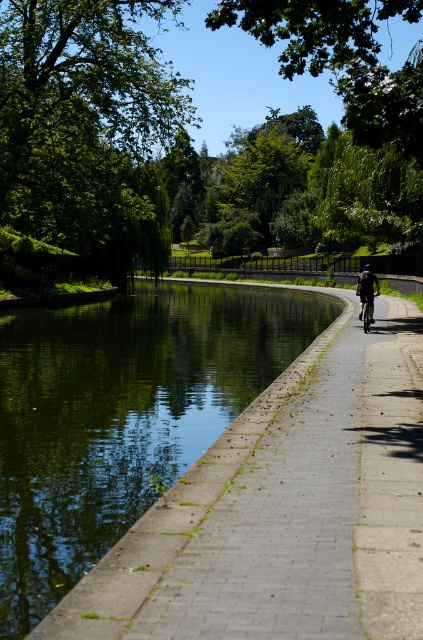
Can you confirm if green concrete river at center is wider than dark blue fabric jacket at center-right?

Yes.

Does green concrete river at center have a larger size compared to dark blue fabric jacket at center-right?

Correct, green concrete river at center is larger in size than dark blue fabric jacket at center-right.

Identify the location of green concrete river at center. The width and height of the screenshot is (423, 640). (120, 417).

Is green concrete river at center positioned in front of shiny silver bicycle at center?

Yes, green concrete river at center is in front of shiny silver bicycle at center.

Locate an element on the screen. green concrete river at center is located at coordinates (120, 417).

Locate an element on the screen. green concrete river at center is located at coordinates (120, 417).

I want to click on green concrete river at center, so click(120, 417).

Is dark blue fabric jacket at center-right to the left of shiny silver bicycle at center from the viewer's perspective?

Incorrect, dark blue fabric jacket at center-right is not on the left side of shiny silver bicycle at center.

Who is taller, dark blue fabric jacket at center-right or shiny silver bicycle at center?

With more height is dark blue fabric jacket at center-right.

What do you see at coordinates (367, 294) in the screenshot? The image size is (423, 640). I see `dark blue fabric jacket at center-right` at bounding box center [367, 294].

You are a GUI agent. You are given a task and a screenshot of the screen. Output one action in this format:
    pyautogui.click(x=<x>, y=<y>)
    Task: Click on the dark blue fabric jacket at center-right
    
    Given the screenshot: What is the action you would take?
    pos(367,294)